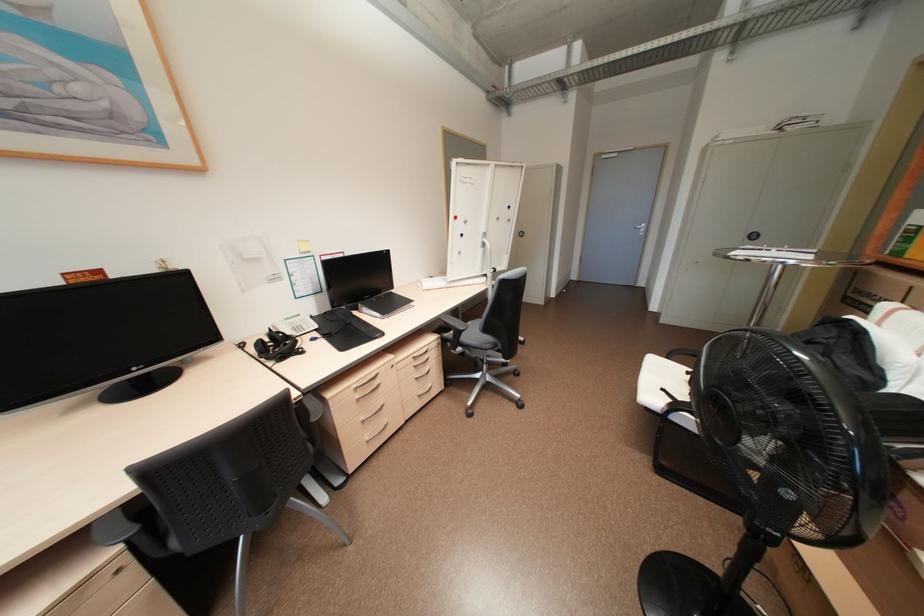
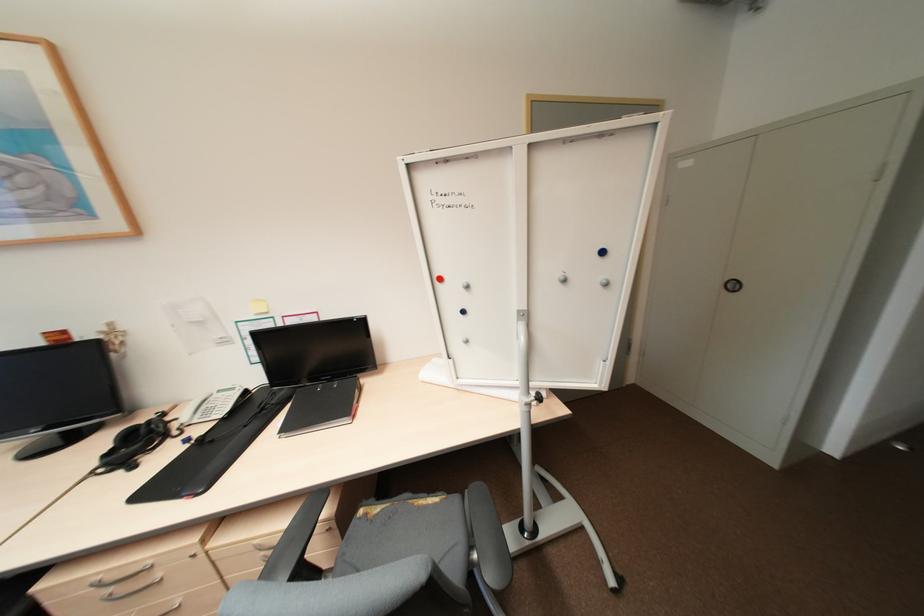
Find the pixel in the second image that matches point 361,389 in the first image.

(104, 584)